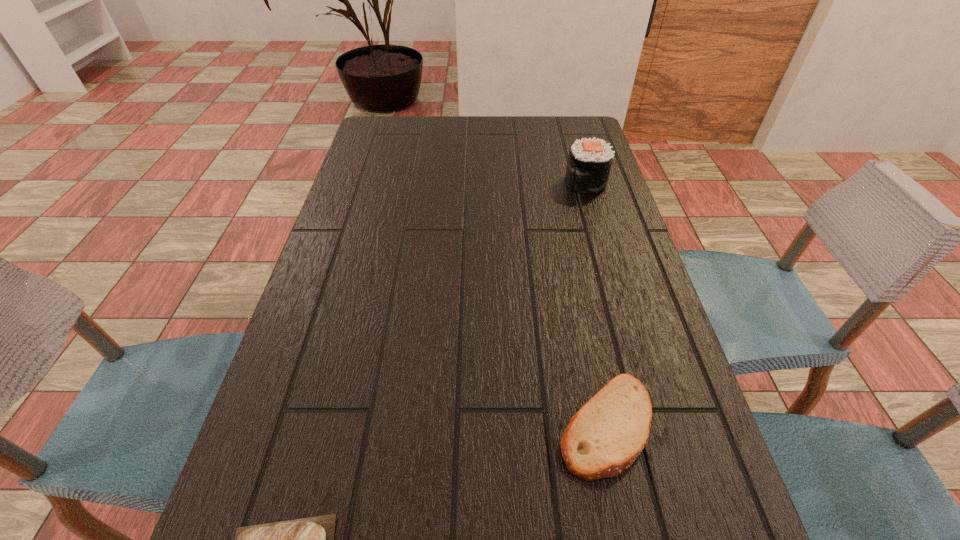
Identify the location of vacant space at the right edge. The image size is (960, 540). (x=656, y=396).

Identify the location of blank space at the far left corner of the desktop. The width and height of the screenshot is (960, 540). (388, 117).

Find the location of a particular element. free point between the right pita bread and the tallest object is located at coordinates (596, 303).

Find the location of `vacant area that lies between the tallest object and the farther pita bread`. vacant area that lies between the tallest object and the farther pita bread is located at coordinates (x=596, y=303).

Locate which object ranks in proximity to the nearest object. Please provide its 2D coordinates. Your answer should be formatted as a tuple, i.e. [(x, y)], where the tuple contains the x and y coordinates of a point satisfying the conditions above.

[(608, 433)]

I want to click on the second closest object to the tallest object, so click(x=311, y=539).